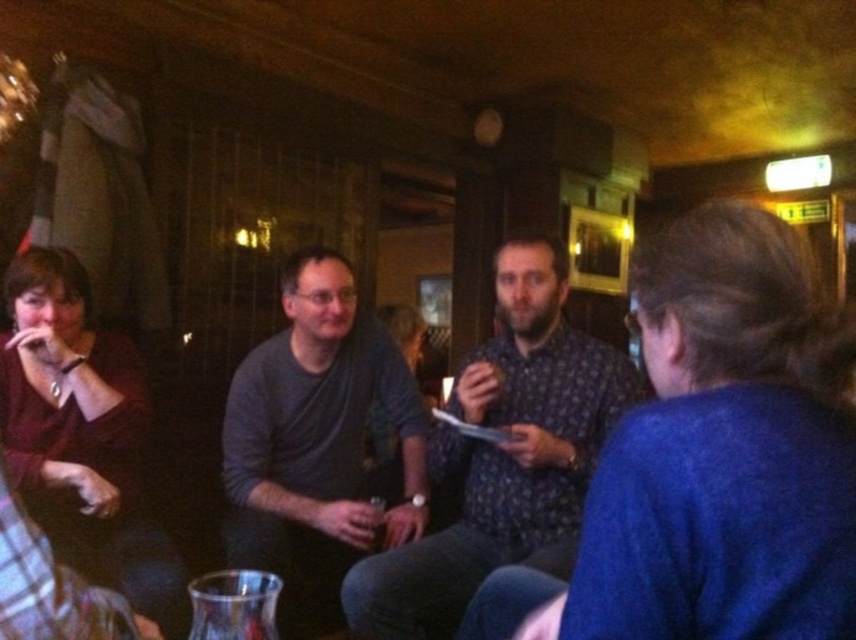
Does floral-patterned shirt at center have a lesser height compared to dark gray sweater at center?

Yes, floral-patterned shirt at center is shorter than dark gray sweater at center.

Which of these two, floral-patterned shirt at center or dark gray sweater at center, stands taller?

dark gray sweater at center

Describe the element at coordinates (504, 456) in the screenshot. I see `floral-patterned shirt at center` at that location.

This screenshot has height=640, width=856. In order to click on floral-patterned shirt at center in this screenshot , I will do `click(504, 456)`.

Locate an element on the screen. floral-patterned shirt at center is located at coordinates (504, 456).

Is floral-patterned shirt at center further to camera compared to clear glass at center?

No, it is in front of clear glass at center.

At what (x,y) coordinates should I click in order to perform the action: click on floral-patterned shirt at center. Please return your answer as a coordinate pair (x, y). Image resolution: width=856 pixels, height=640 pixels. Looking at the image, I should click on (504, 456).

This screenshot has height=640, width=856. In order to click on floral-patterned shirt at center in this screenshot , I will do `click(504, 456)`.

In the scene shown: Is matte burgundy sweater at left above clear glass at center?

Indeed, matte burgundy sweater at left is positioned over clear glass at center.

Identify the location of matte burgundy sweater at left. The image size is (856, 640). (82, 435).

Who is more distant from viewer, (27,506) or (382,512)?

Positioned behind is point (382,512).

The width and height of the screenshot is (856, 640). In order to click on matte burgundy sweater at left in this screenshot , I will do `click(82, 435)`.